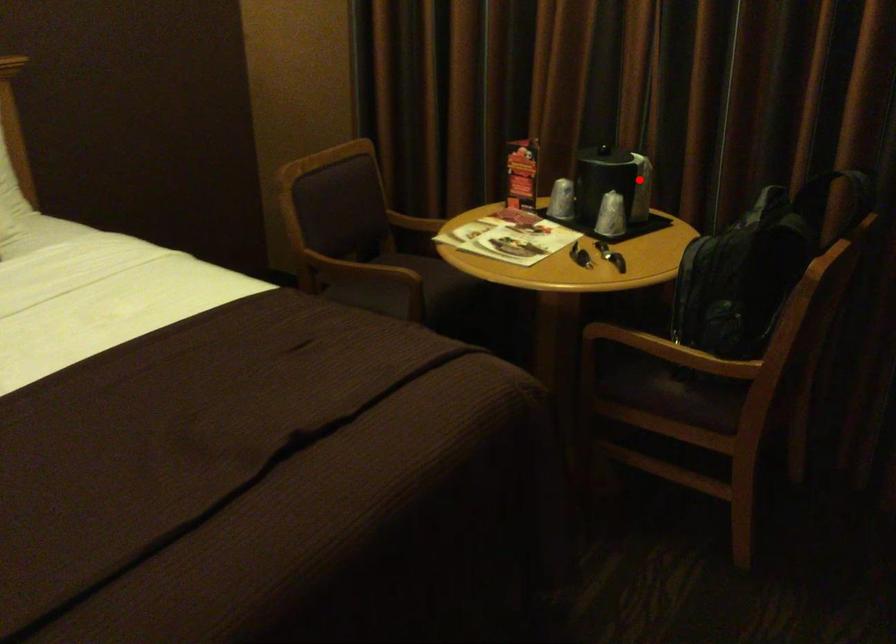
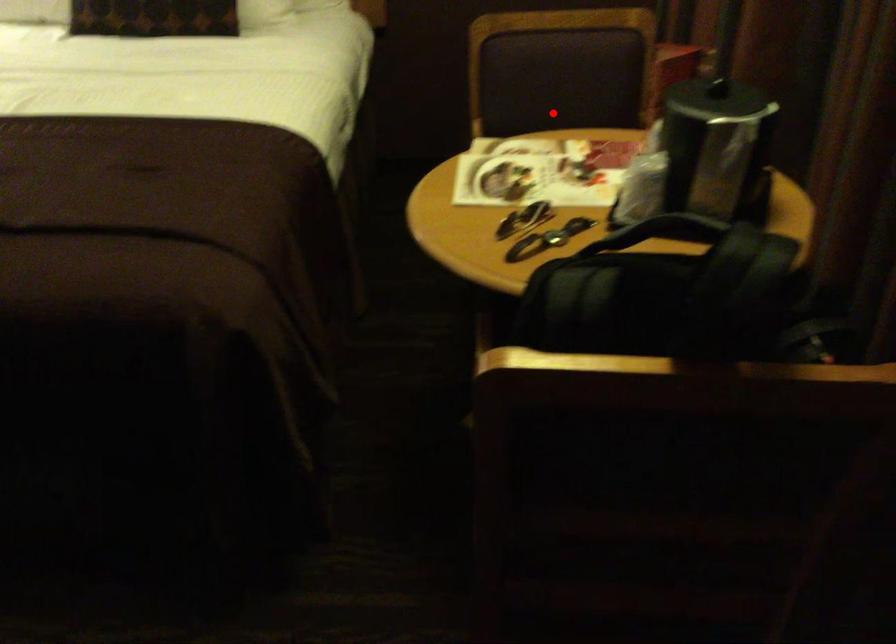
I am providing you with two images of the same scene from different viewpoints. A red point is marked on the first image and another point is marked on the second image. Does the point marked in image1 correspond to the same location as the one in image2?

No